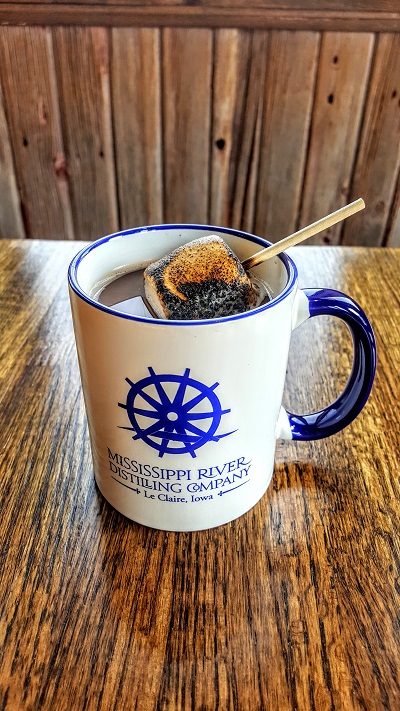
The height and width of the screenshot is (711, 400). Find the location of `wood planks`. wood planks is located at coordinates (143, 141).